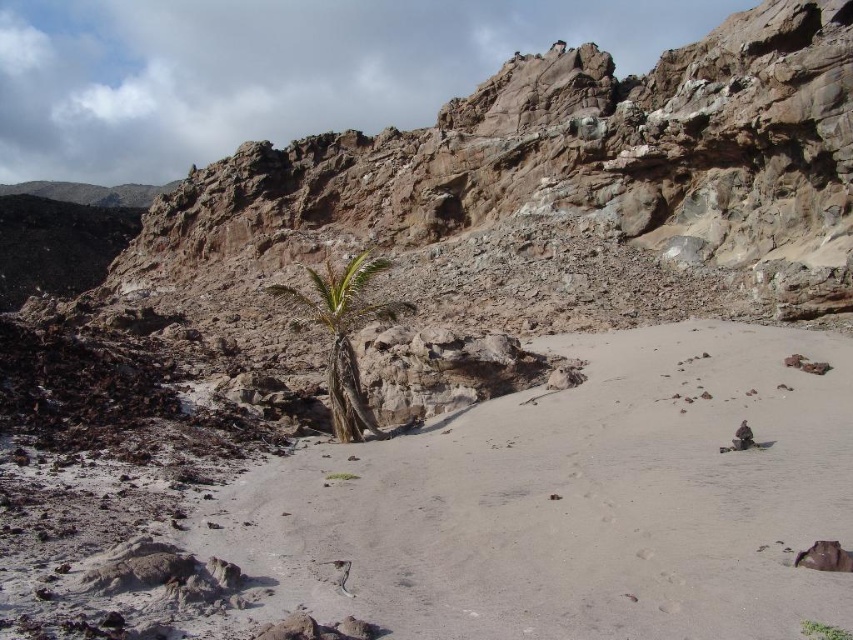
Does green leafy palm tree at center have a greater height compared to green leafy plant at center?

Indeed, green leafy palm tree at center has a greater height compared to green leafy plant at center.

Between green leafy palm tree at center and green leafy plant at center, which one has less height?

green leafy plant at center

Does point (302, 304) come behind point (815, 625)?

Yes, it is.

Locate an element on the screen. green leafy palm tree at center is located at coordinates (344, 337).

Can you confirm if white sandy beach at center is positioned to the right of green leafy palm tree at center?

Correct, you'll find white sandy beach at center to the right of green leafy palm tree at center.

Is white sandy beach at center shorter than green leafy palm tree at center?

Yes, white sandy beach at center is shorter than green leafy palm tree at center.

Who is more distant from viewer, (x=762, y=512) or (x=345, y=378)?

The point (x=345, y=378) is behind.

Locate an element on the screen. This screenshot has height=640, width=853. white sandy beach at center is located at coordinates (569, 502).

Who is positioned more to the left, white sandy beach at center or green leafy plant at center?

white sandy beach at center is more to the left.

Measure the distance between white sandy beach at center and green leafy plant at center.

white sandy beach at center is 17.44 meters from green leafy plant at center.

Find the location of a particular element. white sandy beach at center is located at coordinates (569, 502).